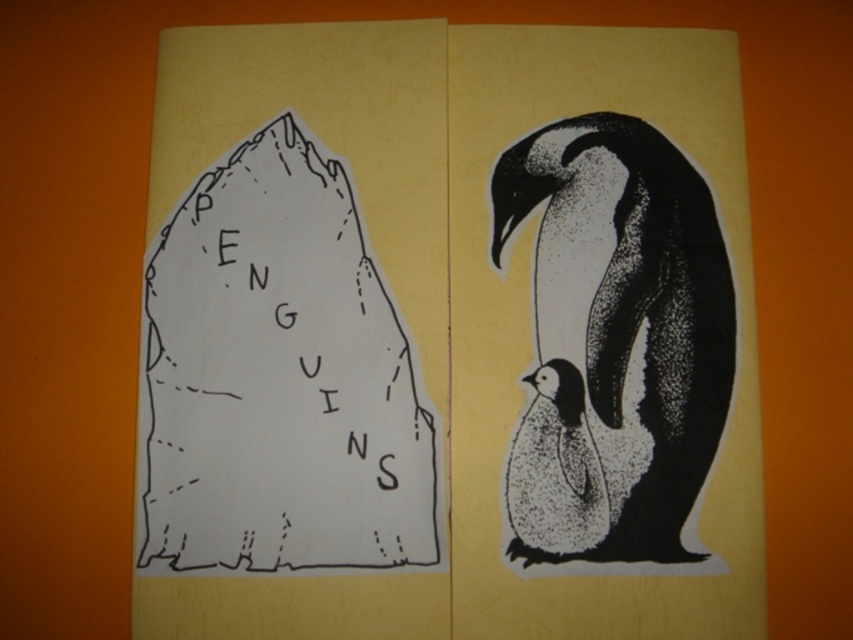
Question: Which point appears farthest from the camera in this image?

Choices:
 (A) (161, 237)
 (B) (569, 461)
 (C) (697, 486)

Answer: (A)

Question: Is black dotted penguin at right in front of speckled white penguin at lower right?

Choices:
 (A) yes
 (B) no

Answer: (A)

Question: Which of the following is the farthest from the observer?

Choices:
 (A) (216, 164)
 (B) (569, 496)

Answer: (A)

Question: Based on their relative distances, which object is nearer to the black dotted penguin at right?

Choices:
 (A) speckled white penguin at lower right
 (B) white paper at center

Answer: (A)

Question: Does white paper at center come in front of speckled white penguin at lower right?

Choices:
 (A) no
 (B) yes

Answer: (B)

Question: Observing the image, what is the correct spatial positioning of black dotted penguin at right in reference to speckled white penguin at lower right?

Choices:
 (A) above
 (B) below

Answer: (A)